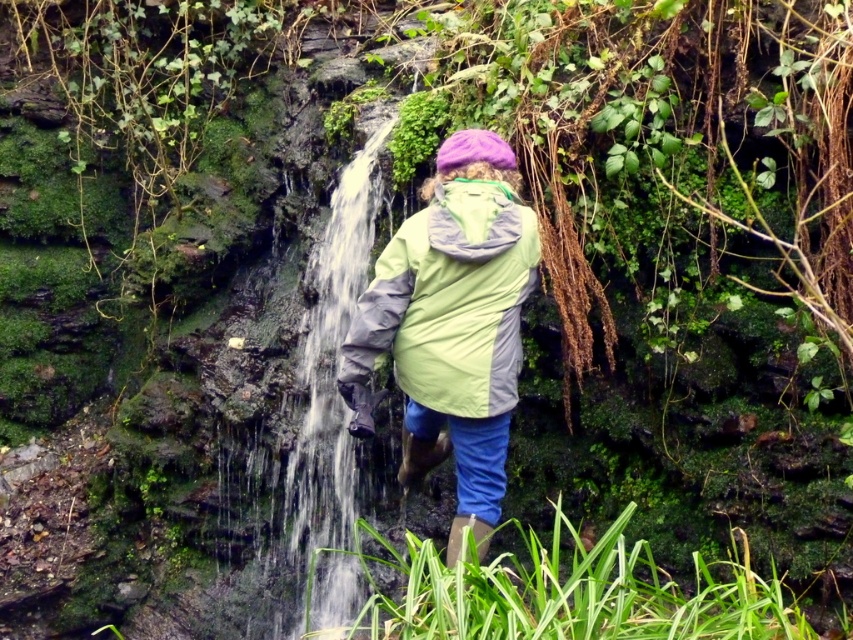
Can you confirm if green leafy grass at lower center is positioned above clear water at center?

No, green leafy grass at lower center is not above clear water at center.

Can you confirm if green leafy grass at lower center is positioned to the left of clear water at center?

Incorrect, green leafy grass at lower center is not on the left side of clear water at center.

Where is `green leafy grass at lower center`? This screenshot has height=640, width=853. green leafy grass at lower center is located at coordinates (569, 593).

Is green leafy grass at lower center bigger than green fabric jacket at center?

Indeed, green leafy grass at lower center has a larger size compared to green fabric jacket at center.

Between point (419, 563) and point (476, 232), which one is positioned behind?

Point (476, 232)

Where is `green leafy grass at lower center`? Image resolution: width=853 pixels, height=640 pixels. green leafy grass at lower center is located at coordinates (569, 593).

Is green fabric jacket at center taller than clear water at center?

No.

Between green fabric jacket at center and clear water at center, which one has more height?

Standing taller between the two is clear water at center.

The height and width of the screenshot is (640, 853). Identify the location of green fabric jacket at center. (450, 301).

Identify the location of green fabric jacket at center. (450, 301).